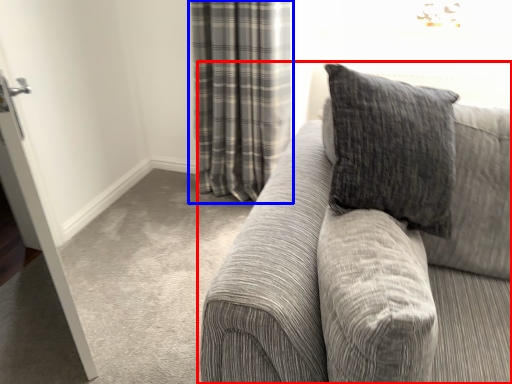
Question: Among these objects, which one is farthest to the camera, studio couch (highlighted by a red box) or curtain (highlighted by a blue box)?

Choices:
 (A) studio couch
 (B) curtain

Answer: (B)